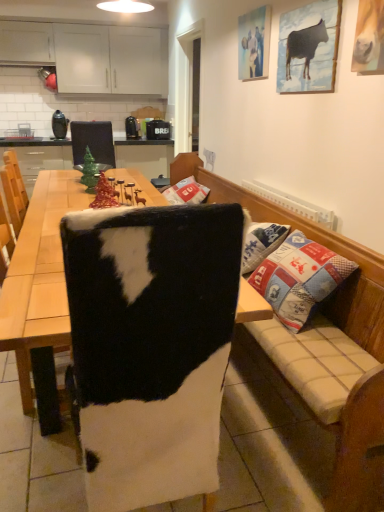
Question: Is cowhide cushion at center at the left side of cowhide at center?

Choices:
 (A) no
 (B) yes

Answer: (A)

Question: From the image's perspective, is cowhide cushion at center located above cowhide at center?

Choices:
 (A) yes
 (B) no

Answer: (A)

Question: From the image's perspective, is cowhide cushion at center under cowhide at center?

Choices:
 (A) no
 (B) yes

Answer: (A)

Question: Can cowhide at center be found inside cowhide cushion at center?

Choices:
 (A) no
 (B) yes

Answer: (A)

Question: From a real-world perspective, is cowhide cushion at center physically above cowhide at center?

Choices:
 (A) no
 (B) yes

Answer: (A)

Question: Considering the relative sizes of cowhide cushion at center and cowhide at center in the image provided, is cowhide cushion at center shorter than cowhide at center?

Choices:
 (A) no
 (B) yes

Answer: (B)

Question: Is wooden picture frame at upper right, which is counted as the 2th picture frame, starting from the left, in front of white matte cabinets at upper left?

Choices:
 (A) no
 (B) yes

Answer: (B)

Question: Can you confirm if wooden picture frame at upper right, which appears as the 1th picture frame when viewed from the front, is shorter than white matte cabinets at upper left?

Choices:
 (A) no
 (B) yes

Answer: (B)

Question: Would you say wooden picture frame at upper right, which is counted as the 2th picture frame, starting from the left, is outside white matte cabinets at upper left?

Choices:
 (A) yes
 (B) no

Answer: (A)

Question: From the image's perspective, would you say wooden picture frame at upper right, the first picture frame when ordered from right to left, is shown under white matte cabinets at upper left?

Choices:
 (A) no
 (B) yes

Answer: (B)

Question: Considering the relative sizes of wooden picture frame at upper right, which is counted as the 2th picture frame, starting from the left, and white matte cabinets at upper left in the image provided, is wooden picture frame at upper right, which is counted as the 2th picture frame, starting from the left, thinner than white matte cabinets at upper left?

Choices:
 (A) no
 (B) yes

Answer: (B)

Question: Could you tell me if wooden picture frame at upper right, positioned as the second picture frame in back-to-front order, is facing white matte cabinets at upper left?

Choices:
 (A) no
 (B) yes

Answer: (A)

Question: Is cowhide at center looking in the opposite direction of wooden picture frame at upper right, the first picture frame when ordered from right to left?

Choices:
 (A) yes
 (B) no

Answer: (B)